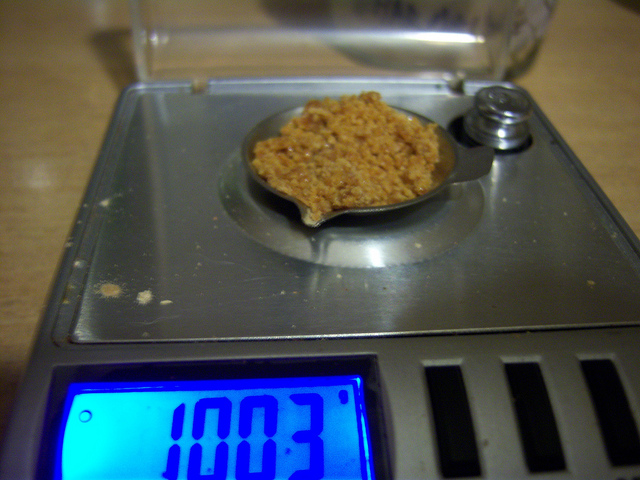
What are the coordinates of `spilled powdery substance on top of scale` in the screenshot? It's located at (107, 290), (145, 295), (164, 299), (589, 280), (104, 200).